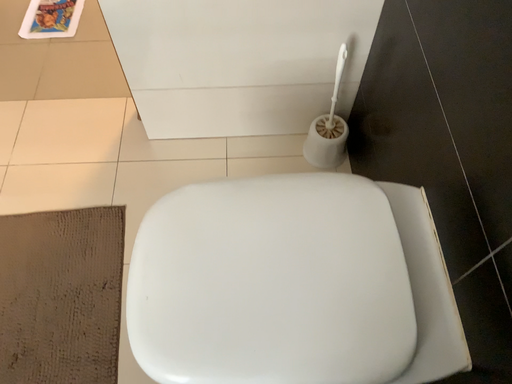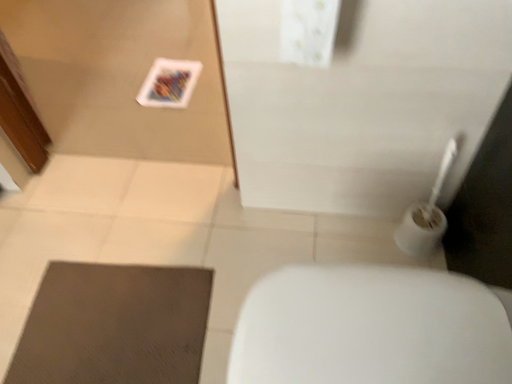
Question: How did the camera likely rotate when shooting the video?

Choices:
 (A) rotated left
 (B) rotated right

Answer: (A)